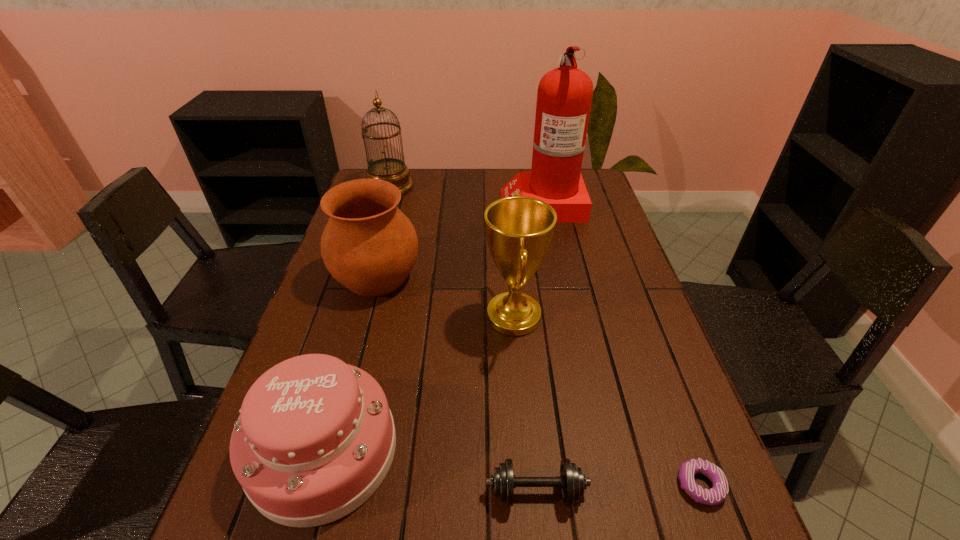
Locate an element on the screen. vacant position in the image that satisfies the following two spatial constraints: 1. by the handles of the shortest object; 2. on the left side of the award is located at coordinates (527, 485).

Identify the location of free space that satisfies the following two spatial constraints: 1. with an open door on the pottery; 2. on the left side of the birdcage. The width and height of the screenshot is (960, 540). (363, 276).

The height and width of the screenshot is (540, 960). Find the location of `free location that satisfies the following two spatial constraints: 1. on the back side of the dumbbell; 2. with an open door on the birdcage`. free location that satisfies the following two spatial constraints: 1. on the back side of the dumbbell; 2. with an open door on the birdcage is located at coordinates (508, 187).

Where is `free space that satisfies the following two spatial constraints: 1. with an open door on the birdcage; 2. on the right side of the pottery`? Image resolution: width=960 pixels, height=540 pixels. free space that satisfies the following two spatial constraints: 1. with an open door on the birdcage; 2. on the right side of the pottery is located at coordinates (363, 276).

Locate an element on the screen. vacant area in the image that satisfies the following two spatial constraints: 1. on the front-facing side of the rightmost object; 2. on the left side of the tallest object is located at coordinates (598, 485).